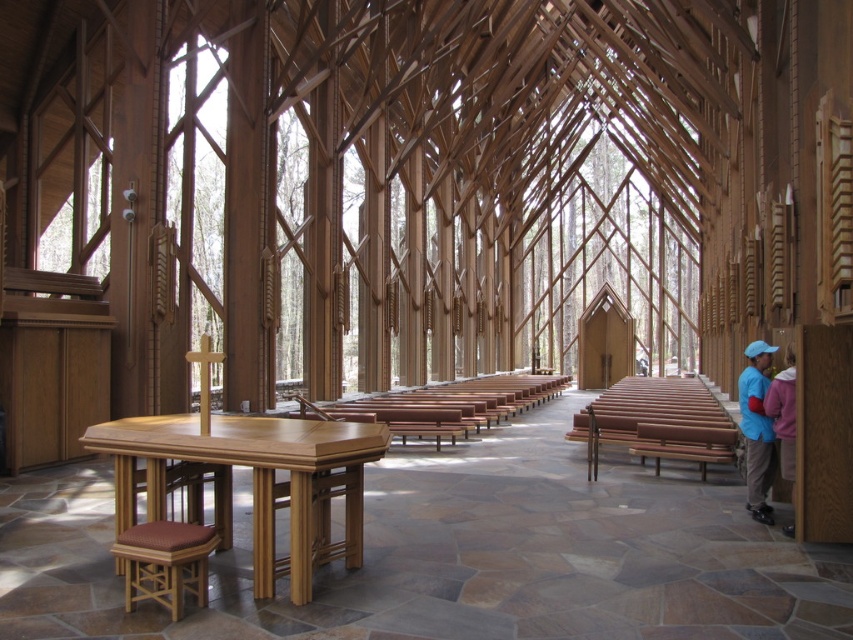
Which of these two, brown polished wood bench at right or blue fabric jacket at lower right, stands shorter?

With less height is brown polished wood bench at right.

How distant is brown polished wood bench at right from blue fabric jacket at lower right?

brown polished wood bench at right and blue fabric jacket at lower right are 5.78 meters apart.

The height and width of the screenshot is (640, 853). In order to click on brown polished wood bench at right in this screenshot , I will do 659,422.

Measure the distance between light brown wood table at center and camera.

4.73 meters

Looking at this image, measure the distance between point [299,580] and camera.

The distance of point [299,580] from camera is 4.98 meters.

Is point (300, 500) positioned in front of point (782, 422)?

That is True.

Find the location of `light brown wood table at center`. light brown wood table at center is located at coordinates (252, 481).

Which of these two, brown polished wood bench at right or wooden cushioned stool at lower left, stands shorter?

wooden cushioned stool at lower left is shorter.

Is brown polished wood bench at right to the right of wooden cushioned stool at lower left from the viewer's perspective?

Correct, you'll find brown polished wood bench at right to the right of wooden cushioned stool at lower left.

This screenshot has height=640, width=853. Identify the location of brown polished wood bench at right. (659, 422).

Locate an element on the screen. This screenshot has width=853, height=640. brown polished wood bench at right is located at coordinates (659, 422).